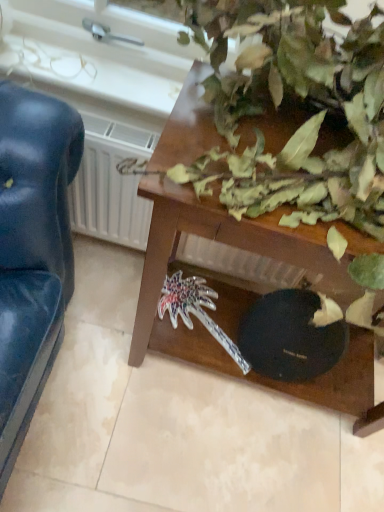
Measure the distance between green leafy plant at upper right and camera.

The depth of green leafy plant at upper right is 20.87 inches.

Looking at this image, what is the approximate height of green leafy plant at upper right?

The height of green leafy plant at upper right is 31.43 inches.

This screenshot has height=512, width=384. In order to click on green leafy plant at upper right in this screenshot , I will do `click(306, 103)`.

What do you see at coordinates (306, 103) in the screenshot? This screenshot has width=384, height=512. I see `green leafy plant at upper right` at bounding box center [306, 103].

The width and height of the screenshot is (384, 512). I want to click on green leafy plant at upper right, so click(306, 103).